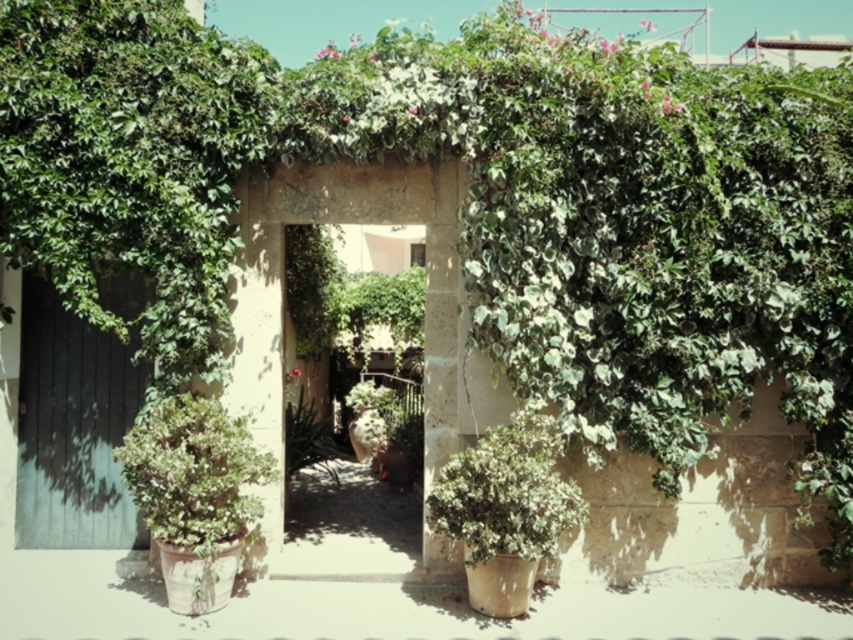
Question: Can you confirm if green matte potted plant at left is positioned above green matte plant at center?

Choices:
 (A) no
 (B) yes

Answer: (A)

Question: Can you confirm if dark wood door at left is smaller than green matte plant at center?

Choices:
 (A) no
 (B) yes

Answer: (B)

Question: Considering the real-world distances, which object is closest to the green matte potted plant at left?

Choices:
 (A) dark wood door at left
 (B) green leafy archway at center

Answer: (B)

Question: Estimate the real-world distances between objects in this image. Which object is farther from the dark wood door at left?

Choices:
 (A) green leafy archway at center
 (B) green matte plant at center

Answer: (B)

Question: Considering the relative positions of dark wood door at left and green matte potted plant at left in the image provided, where is dark wood door at left located with respect to green matte potted plant at left?

Choices:
 (A) above
 (B) below

Answer: (A)

Question: Which point appears closest to the camera in this image?

Choices:
 (A) (534, 528)
 (B) (67, 312)

Answer: (A)